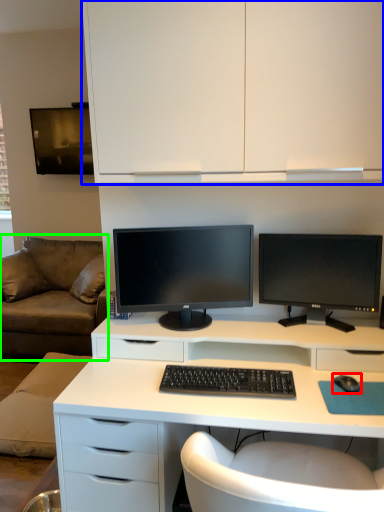
Question: Based on their relative distances, which object is nearer to mouse (highlighted by a red box)? Choose from cabinetry (highlighted by a blue box) and studio couch (highlighted by a green box).

Choices:
 (A) cabinetry
 (B) studio couch

Answer: (A)